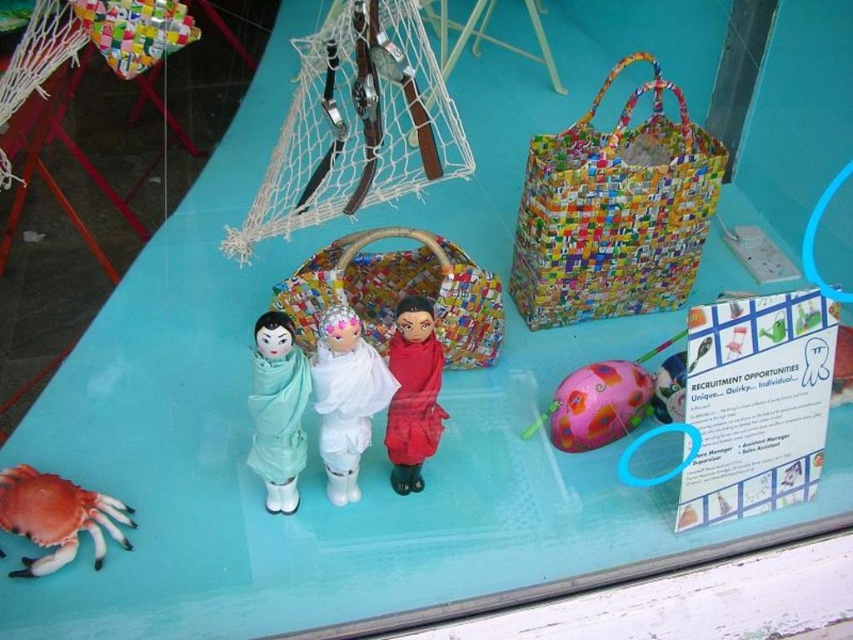
You are standing in front of the display setup on the light blue surface. There is a point marked at coordinates (358, 396). If you want to place a 12 inch wide decorative item on the surface without moving the existing items, will there be enough space between you and that point to fit it?

The distance between you and the point (358, 396) is 35.60 inches. Since the decorative item is 12 inches wide, there is sufficient space as 35.60 inches is greater than 12 inches.

You are an interior designer planning to place the matte green fabric doll at center and the red plastic crab at lower left on a shelf. Which object should you place first if you want to arrange them from smallest to largest width?

The matte green fabric doll at center has a smaller width than the red plastic crab at lower left, so you should place the matte green fabric doll at center first when arranging from smallest to largest width.

You are an interior designer evaluating the display setup. You need to ensure that the white glossy doll at center and the matte green fabric doll at center are visible from a distance. Considering their sizes, which doll should be placed higher to ensure both are easily seen?

The white glossy doll at center is larger in size than the matte green fabric doll at center. To ensure both are easily seen, the smaller matte green fabric doll at center should be placed higher so it can be viewed alongside the larger white glossy doll at center.